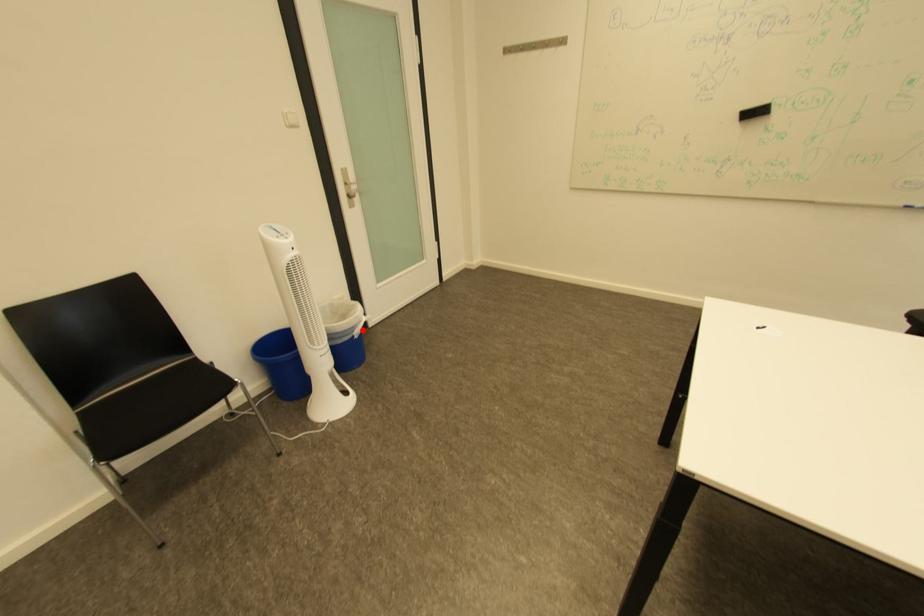
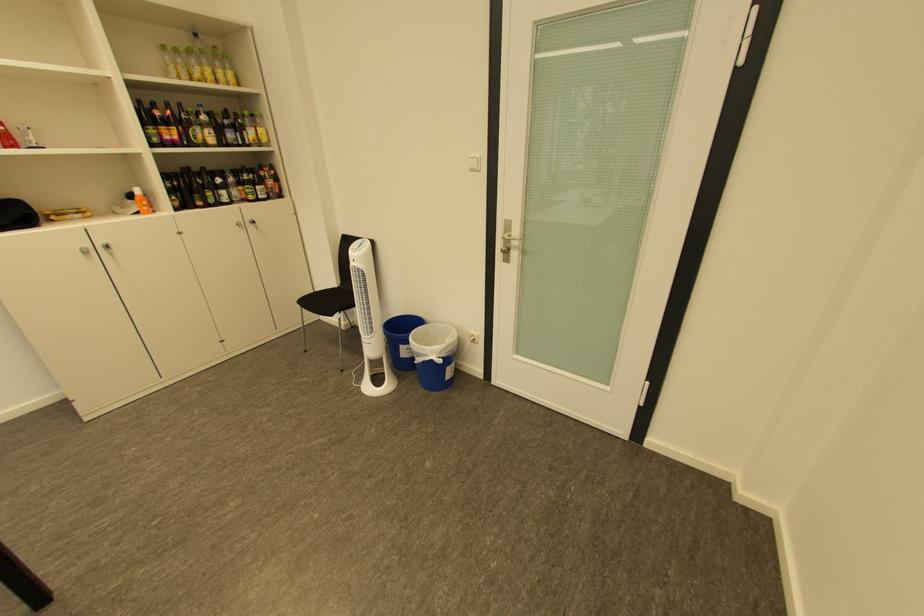
Question: I am providing you with two images of the same scene from different viewpoints. Image1 has a red point marked. In image2, the corresponding 3D location appears at what relative position? Reply with the corresponding letter.

Choices:
 (A) Closer
 (B) Farther

Answer: (B)